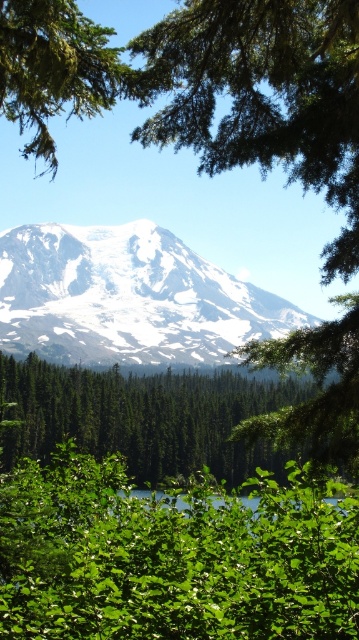
Question: Which point appears closest to the camera in this image?

Choices:
 (A) [x=225, y=372]
 (B) [x=22, y=12]
 (C) [x=106, y=358]

Answer: (B)

Question: Considering the relative positions of green leafy tree at center and green leafy tree at upper left in the image provided, where is green leafy tree at center located with respect to green leafy tree at upper left?

Choices:
 (A) above
 (B) below

Answer: (B)

Question: Does white snow-covered mountain at center appear on the right side of green leafy tree at upper left?

Choices:
 (A) no
 (B) yes

Answer: (B)

Question: Does white snow-covered mountain at center lie in front of green leafy tree at upper left?

Choices:
 (A) yes
 (B) no

Answer: (B)

Question: Which of the following is the farthest from the observer?

Choices:
 (A) (76, 106)
 (B) (100, 404)

Answer: (B)

Question: Which object appears closest to the camera in this image?

Choices:
 (A) white snow-covered mountain at center
 (B) green leafy tree at center
 (C) green leafy tree at upper left

Answer: (C)